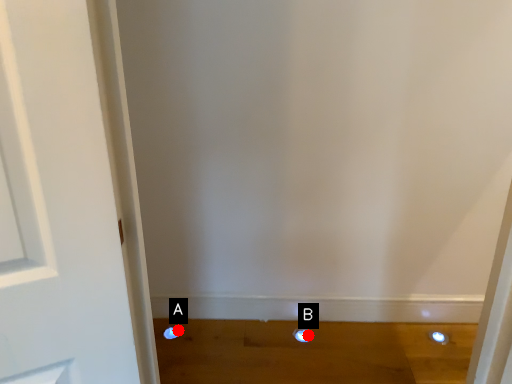
Question: Two points are circled on the image, labeled by A and B beside each circle. Which point appears farthest from the camera in this image?

Choices:
 (A) A is further
 (B) B is further

Answer: (A)